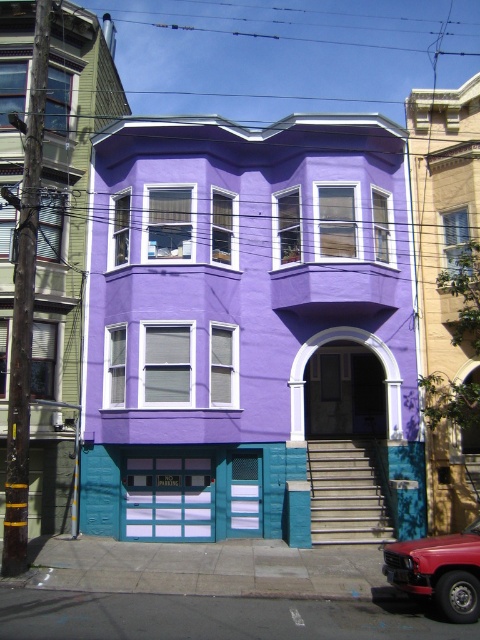
Can you confirm if matte blue garage door at lower center is wider than shiny red car at lower right?

Yes, matte blue garage door at lower center is wider than shiny red car at lower right.

Which is more to the left, matte blue garage door at lower center or shiny red car at lower right?

matte blue garage door at lower center

You are a GUI agent. You are given a task and a screenshot of the screen. Output one action in this format:
    pyautogui.click(x=<x>, y=<y>)
    Task: Click on the matte blue garage door at lower center
    The image size is (480, 640).
    Given the screenshot: What is the action you would take?
    pyautogui.click(x=168, y=497)